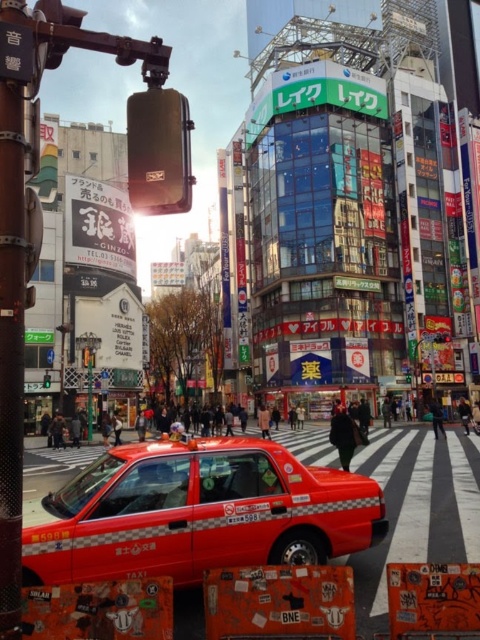
From the picture: You are a delivery driver who needs to park your vehicle in the parking lot located at the coordinates 0.802, 0.415. Is the shiny red taxi at center currently occupying that space?

The shiny red taxi at center is located at coordinates [199,513], so it is occupying the space where the parking lot is located. You cannot park there.

You are a pedestrian standing at the crosswalk and see the shiny red taxi at center and the green glass traffic light at upper center. Which object is closer to you?

The shiny red taxi at center is closer to you because it is in front of the green glass traffic light at upper center.

In the scene shown: You are a delivery driver who needs to park your truck, which is 2 meters wide, in this street. There is a shiny red taxi at center and a green glass traffic light at upper center. Can you fit your truck between them without touching either?

The shiny red taxi at center might be wider than the green glass traffic light at upper center, but since the truck is 2 meters wide, we cannot determine if there is enough space between them without knowing the exact width of the taxi and the distance between the two objects. Please check the actual dimensions before attempting to park.